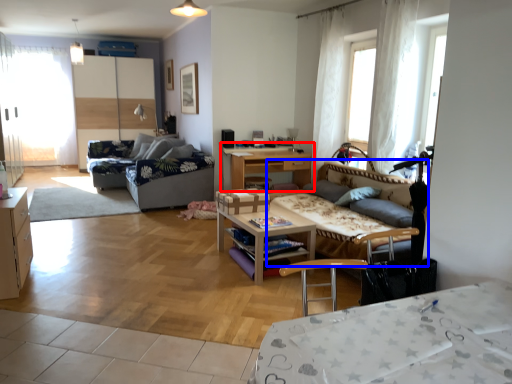
Question: Which of the following is the closest to the observer, table (highlighted by a red box) or studio couch (highlighted by a blue box)?

Choices:
 (A) table
 (B) studio couch

Answer: (B)